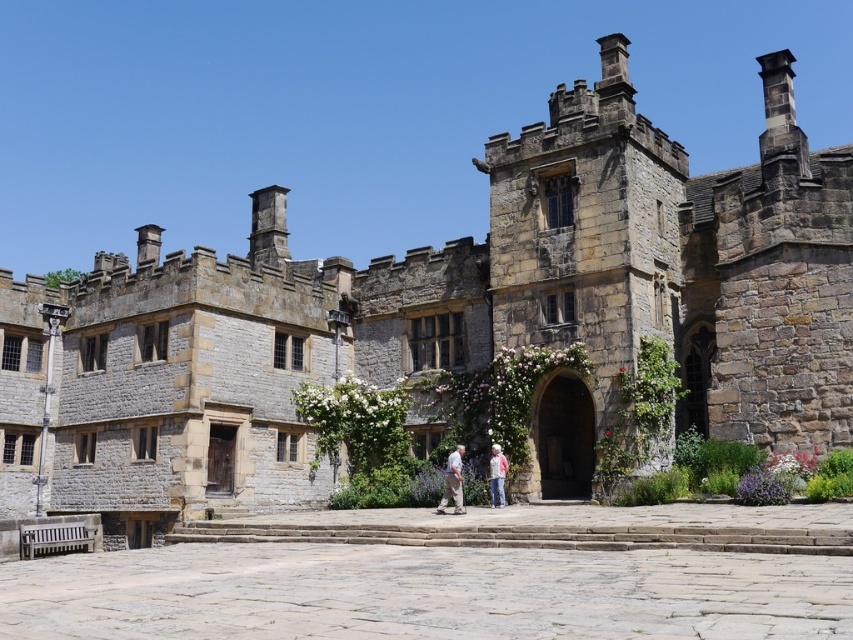
Question: Considering the real-world distances, which object is closest to the light beige fabric pants at center?

Choices:
 (A) light pink fabric at center
 (B) pink fabric jacket at center

Answer: (A)

Question: Does light beige fabric pants at center have a lesser width compared to pink fabric jacket at center?

Choices:
 (A) yes
 (B) no

Answer: (B)

Question: Is light pink fabric at center further to camera compared to pink fabric jacket at center?

Choices:
 (A) no
 (B) yes

Answer: (A)

Question: Can you confirm if light pink fabric at center is thinner than light beige fabric pants at center?

Choices:
 (A) no
 (B) yes

Answer: (A)

Question: Which of these objects is positioned farthest from the light pink fabric at center?

Choices:
 (A) pink fabric jacket at center
 (B) light beige fabric pants at center

Answer: (A)

Question: Which of the following is the closest to the observer?

Choices:
 (A) (445, 492)
 (B) (447, 484)

Answer: (B)